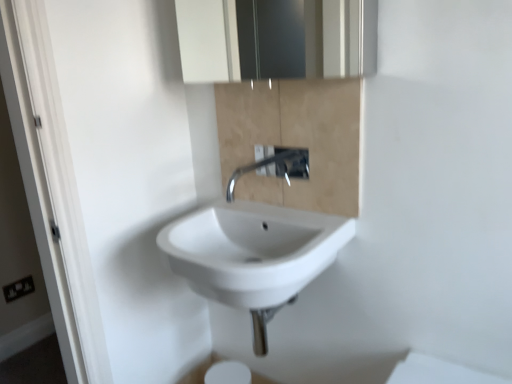
Question: In terms of width, does satin chrome faucet at center look wider or thinner when compared to white glossy sink at center?

Choices:
 (A) thin
 (B) wide

Answer: (A)

Question: From the image's perspective, is satin chrome faucet at center located above or below white glossy sink at center?

Choices:
 (A) above
 (B) below

Answer: (A)

Question: Which is farther from the black plastic electrical outlet at lower left?

Choices:
 (A) satin chrome faucet at center
 (B) beige marble cabinet at center
 (C) white glossy sink at center
 (D) white glossy medicine cabinet at upper center

Answer: (D)

Question: Which is nearer to the black plastic electrical outlet at lower left?

Choices:
 (A) satin chrome faucet at center
 (B) beige marble cabinet at center
 (C) white glossy medicine cabinet at upper center
 (D) white glossy sink at center

Answer: (A)